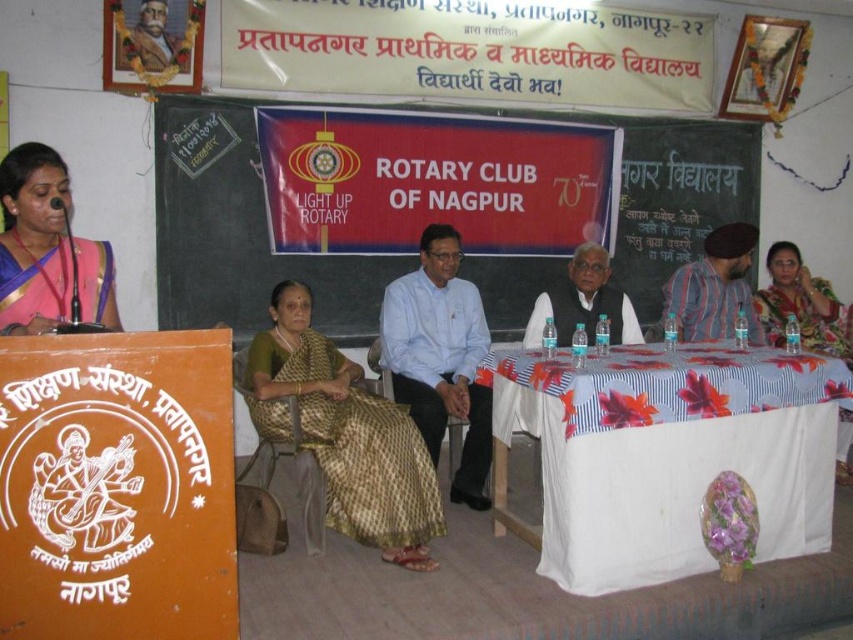
Question: Is floral saree at right positioned at the back of white textured shirt at center?

Choices:
 (A) no
 (B) yes

Answer: (B)

Question: Considering the relative positions of white cloth-covered table at lower right and white textured shirt at center in the image provided, where is white cloth-covered table at lower right located with respect to white textured shirt at center?

Choices:
 (A) left
 (B) right

Answer: (B)

Question: Is white cloth-covered table at lower right bigger than red banner at center?

Choices:
 (A) no
 (B) yes

Answer: (B)

Question: Among these objects, which one is nearest to the camera?

Choices:
 (A) gold brocade saree at center
 (B) matte gold saree at right

Answer: (A)

Question: Which object appears farthest from the camera in this image?

Choices:
 (A) pink silk saree at left
 (B) striped cotton shirt at center

Answer: (B)

Question: Which of the following is the farthest from the observer?

Choices:
 (A) matte gold saree at right
 (B) painted portrait of man at upper left
 (C) striped cotton shirt at center
 (D) floral saree at right

Answer: (D)